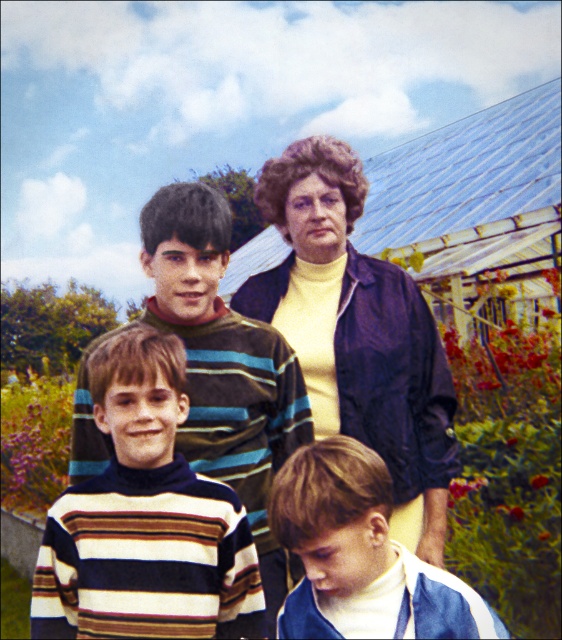
You are a photographer adjusting the camera settings to ensure both the matte yellow sweater at center and the striped sweater at lower center are in focus. Which sweater should you focus on first to account for their sizes?

The matte yellow sweater at center is taller than the striped sweater at lower center, so you should focus on the matte yellow sweater at center first as it is larger and requires more attention to capture details properly.

Based on the photo, you are a fashion designer observing the family portrait. You notice two striped sweaters in the image. Which one is positioned higher up, the striped turtleneck sweater at center or the striped sweater at lower center?

The striped turtleneck sweater at center is located above the striped sweater at lower center, so it is positioned higher up.

You are standing at the position of the adult woman in the family portrait. You want to move towards the point at coordinates point (138, 547) and point (364, 305). Which point will you reach first?

Point (138, 547) is in front of point (364, 305), so you will reach point (138, 547) first.